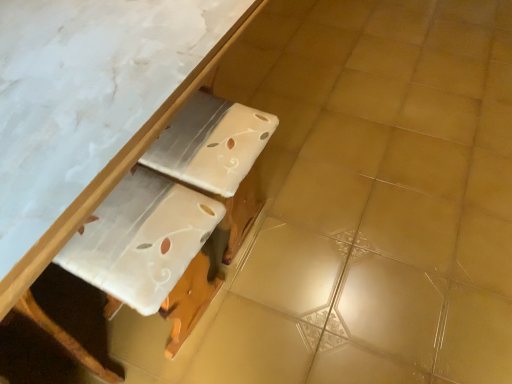
This screenshot has width=512, height=384. Find the location of `free location to the right of white glossy cardboard at center`. free location to the right of white glossy cardboard at center is located at coordinates (267, 309).